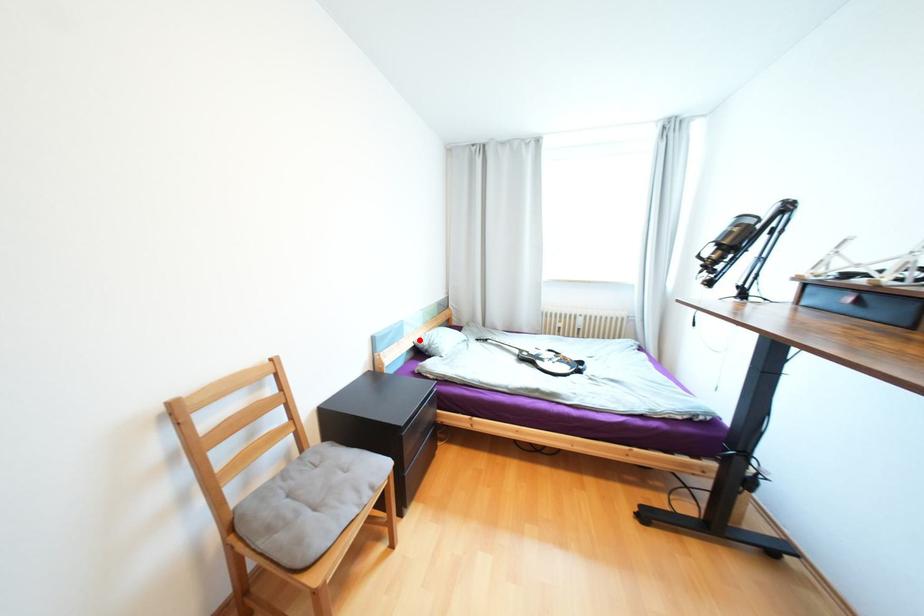
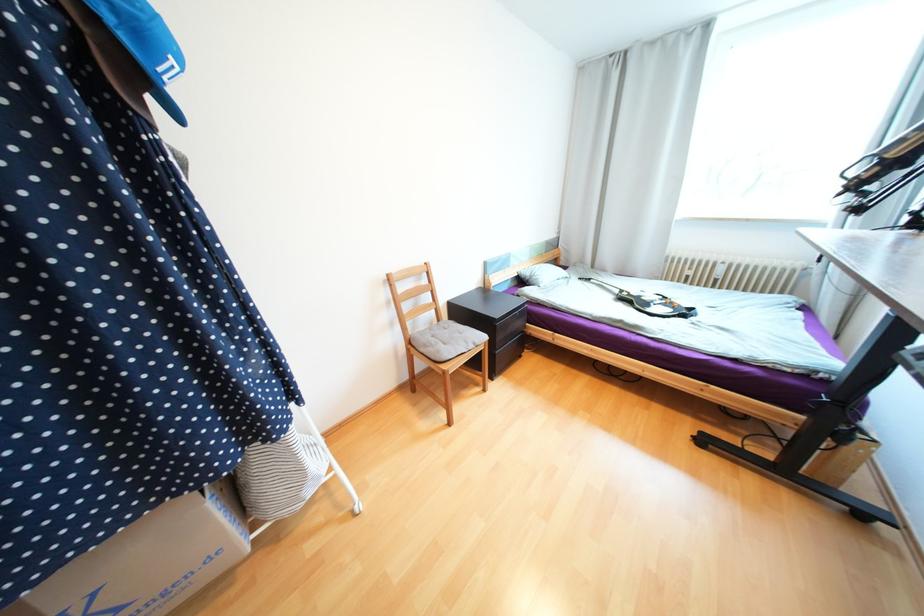
Question: A red point is marked in image1. In image2, is the corresponding 3D point closer to the camera or farther? Reply with the corresponding letter.

Choices:
 (A) The corresponding 3D point is closer.
 (B) The corresponding 3D point is farther.

Answer: (A)